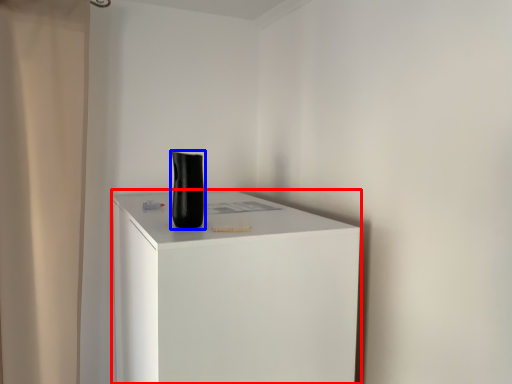
Question: Which object is further to the camera taking this photo, furniture (highlighted by a red box) or vase (highlighted by a blue box)?

Choices:
 (A) furniture
 (B) vase

Answer: (B)